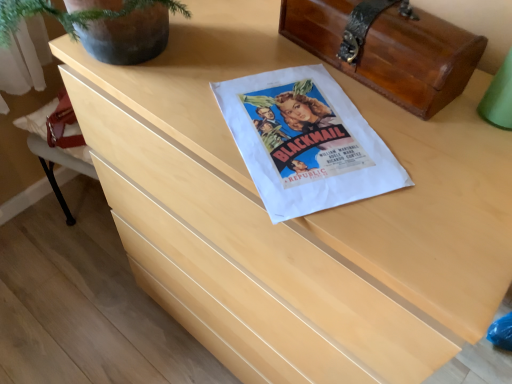
You are a GUI agent. You are given a task and a screenshot of the screen. Output one action in this format:
    pyautogui.click(x=<x>, y=<y>)
    Task: Click on the vacant region below white paper flyer at center (from a real-world perspective)
    This screenshot has height=384, width=512.
    Given the screenshot: What is the action you would take?
    pyautogui.click(x=313, y=135)